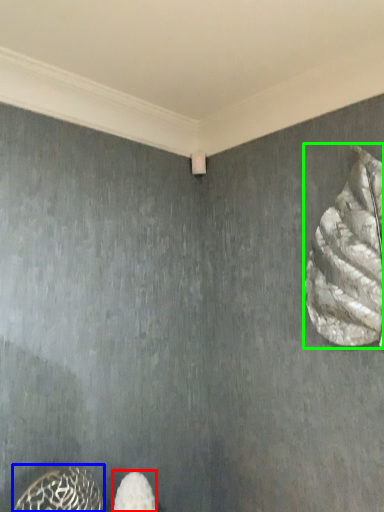
Question: Which object is the farthest from footwear (highlighted by a red box)? Choose among these: animal (highlighted by a blue box) or animal (highlighted by a green box).

Choices:
 (A) animal
 (B) animal

Answer: (B)